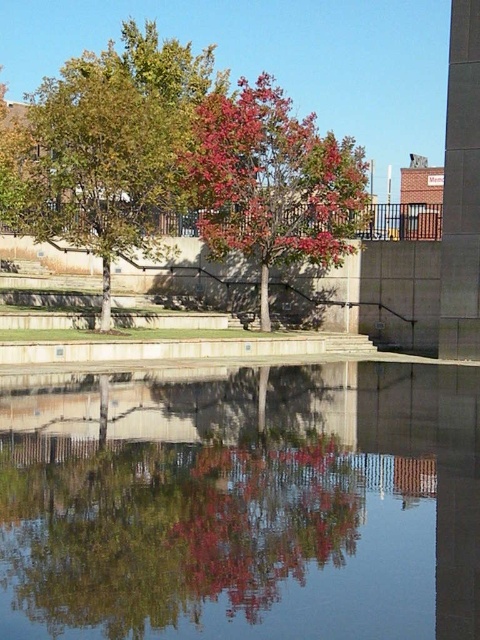
Looking at this image, you are standing at the point with coordinates point (279,140) in the park. You want to walk towards the point with coordinates point (228,529). Which direction should you move relative to your current position?

You should move forward because point (228,529) is in front of point (279,140).

You are standing at the edge of the park and want to take a photo of both the smooth reflective water at center and the green leafy tree at center. Which object will appear closer to the camera in the photo?

The smooth reflective water at center will appear closer to the camera in the photo because it is shorter than the green leafy tree at center, making it physically nearer to the camera position.

You are an artist trying to capture the scene in the image. You notice the smooth reflective water at center and the shiny red leaves at center. Which object appears narrower in your painting?

The smooth reflective water at center appears narrower than the shiny red leaves at center in the painting.